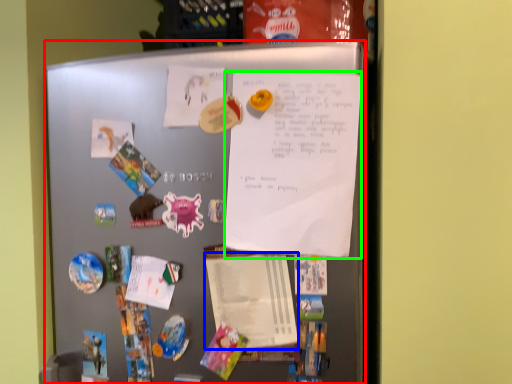
Question: Estimate the real-world distances between objects in this image. Which object is closer to refrigerator (highlighted by a red box), notepad (highlighted by a blue box) or poster (highlighted by a green box)?

Choices:
 (A) notepad
 (B) poster

Answer: (B)